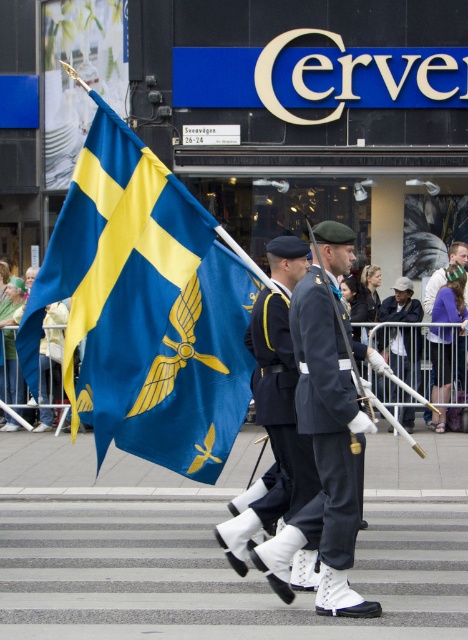
You are a photographer positioned at the side of the pedestrian crossing. You want to capture a photo of both the navy blue fabric uniform at center and the light brown leather jacket at center. Which object should you focus on first to ensure both are in sharp focus?

The navy blue fabric uniform at center is closer to the viewer than the light brown leather jacket at center, so you should focus on the navy blue fabric uniform at center first to ensure both are in sharp focus.

You are a photographer positioned at the side of the pedestrian crossing. You want to capture a photo of both the dark blue uniform at center and the dark blue fabric uniform at center in the same frame. Which one should you adjust your camera angle to focus on first to ensure both are in view?

You should focus on the dark blue fabric uniform at center first because the dark blue uniform at center is to the right of it, so adjusting to include both would require framing from the leftmost object first.

You are a photographer trying to capture a photo of both the blue fabric flag at left and the light brown leather jacket at center in the same frame. Given that your camera has a 50mm lens, which has a field of view of approximately 46 degrees on a full frame sensor, can you estimate if both objects will fit in the frame from your current position?

The blue fabric flag at left and light brown leather jacket at center are 19.48 feet apart. To determine if they fit in the frame, we need to calculate the minimum distance required for the 46 degree field of view to encompass 19.48 feet. Using the formula for field of view width at distance d, width in feet at distance d is 2 x d x tan fov angle. Rearranged, the required distance would be 19.48 divided by 2 x tan 23 degrees. Calculating tan 23 gives approximately 0.424. Thus, 19.48 divided by 2 x 0.424 is